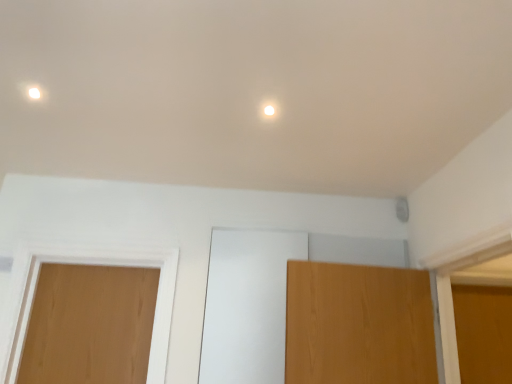
Question: Should I look upward or downward to see light brown wood door at left?

Choices:
 (A) down
 (B) up

Answer: (A)

Question: Is light brown wood door at left completely or partially inside white glossy light fixture at upper center?

Choices:
 (A) no
 (B) yes

Answer: (A)

Question: Could you tell me if white glossy light fixture at upper center is turned towards light brown wood door at left?

Choices:
 (A) yes
 (B) no

Answer: (B)

Question: Considering the relative sizes of white glossy light fixture at upper center and light brown wood door at left in the image provided, is white glossy light fixture at upper center taller than light brown wood door at left?

Choices:
 (A) no
 (B) yes

Answer: (A)

Question: Does white glossy light fixture at upper center have a lesser width compared to light brown wood door at left?

Choices:
 (A) no
 (B) yes

Answer: (B)

Question: Does white glossy light fixture at upper center have a greater width compared to light brown wood door at left?

Choices:
 (A) yes
 (B) no

Answer: (B)

Question: Is white glossy light fixture at upper center beside light brown wood door at left?

Choices:
 (A) yes
 (B) no

Answer: (B)

Question: Does light brown wood door at left have a greater height compared to white glossy light fixture at upper center?

Choices:
 (A) yes
 (B) no

Answer: (A)

Question: Considering the relative sizes of light brown wood door at left and white glossy light fixture at upper center in the image provided, is light brown wood door at left shorter than white glossy light fixture at upper center?

Choices:
 (A) no
 (B) yes

Answer: (A)

Question: Can you confirm if light brown wood door at left is positioned to the left of white glossy light fixture at upper center?

Choices:
 (A) yes
 (B) no

Answer: (A)

Question: Considering the relative sizes of light brown wood door at left and white glossy light fixture at upper center in the image provided, is light brown wood door at left wider than white glossy light fixture at upper center?

Choices:
 (A) yes
 (B) no

Answer: (A)

Question: From a real-world perspective, is light brown wood door at left on white glossy light fixture at upper center?

Choices:
 (A) no
 (B) yes

Answer: (A)

Question: Is light brown wood door at left completely or partially outside of white glossy light fixture at upper center?

Choices:
 (A) yes
 (B) no

Answer: (A)

Question: Is light brown wood door at left bigger or smaller than white glossy light fixture at upper center?

Choices:
 (A) big
 (B) small

Answer: (A)